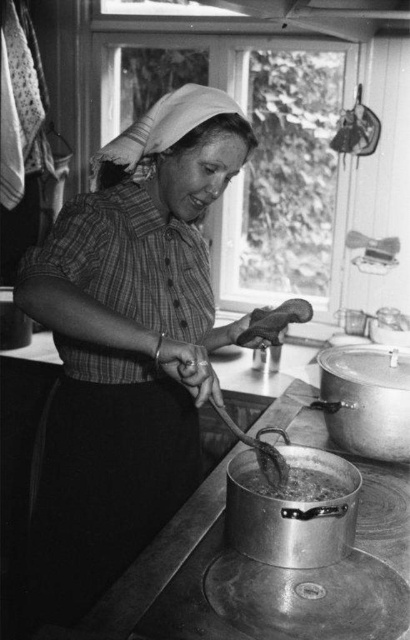
You are a safety inspector checking the kitchen setup. The matte plaid shirt at center and boiling liquid at lower center are present. Is there a risk of the shirt catching fire from the boiling liquid?

The matte plaid shirt at center is in front of boiling liquid at lower center, which means the shirt is closer to the heat source. This poses a fire hazard as the shirt could catch fire if it comes into contact with the hot stove or boiling liquid.

Where is the matte plaid shirt at center located in the image?

The matte plaid shirt at center is located at point (129, 346) in the image.

In the rustic kitchen scene, there is a woman wearing a matte plaid shirt at center and a boiling liquid at lower center. From the perspective of someone standing in front of the stove, which object is positioned to the right?

The boiling liquid at lower center is to the right of the matte plaid shirt at center.